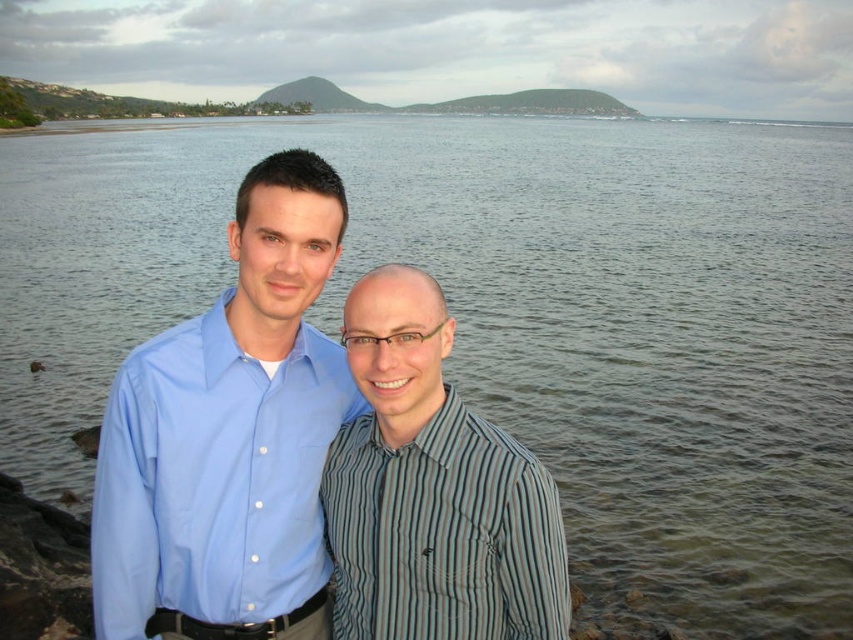
Can you confirm if light blue cotton shirt at center is taller than striped cotton shirt at center?

Yes.

I want to click on light blue cotton shirt at center, so click(x=213, y=477).

Is blue smooth shirt at center further to camera compared to light blue cotton shirt at center?

That is True.

How distant is blue smooth shirt at center from light blue cotton shirt at center?

blue smooth shirt at center and light blue cotton shirt at center are 8.19 centimeters apart.

What do you see at coordinates (229, 436) in the screenshot?
I see `blue smooth shirt at center` at bounding box center [229, 436].

Locate an element on the screen. blue smooth shirt at center is located at coordinates (229, 436).

What do you see at coordinates (229, 436) in the screenshot? Image resolution: width=853 pixels, height=640 pixels. I see `blue smooth shirt at center` at bounding box center [229, 436].

The width and height of the screenshot is (853, 640). What do you see at coordinates (229, 436) in the screenshot?
I see `blue smooth shirt at center` at bounding box center [229, 436].

Identify the location of blue smooth shirt at center. Image resolution: width=853 pixels, height=640 pixels. tap(229, 436).